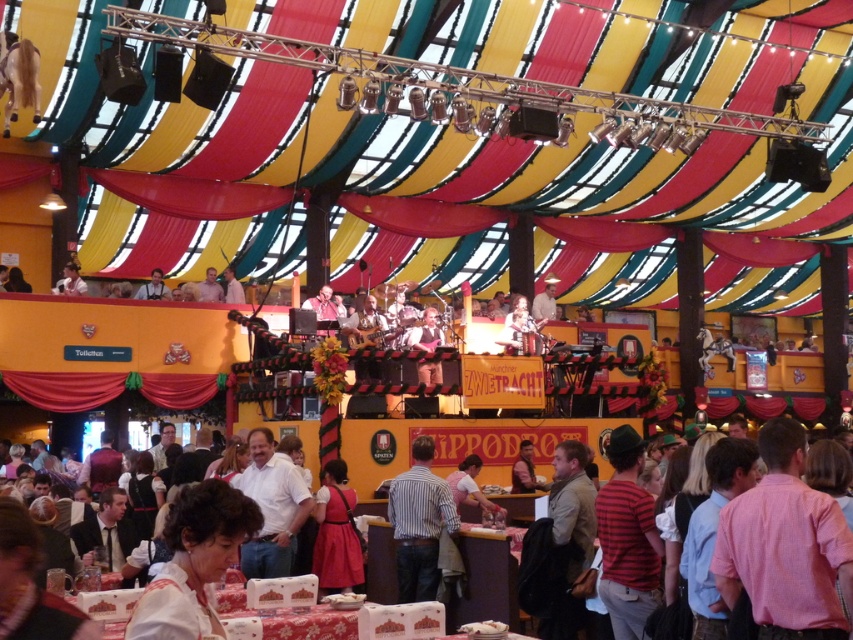
Who is taller, matte black shirt at upper center or light beige shirt at upper center?

light beige shirt at upper center

Is matte black shirt at upper center above light beige shirt at upper center?

No, matte black shirt at upper center is not above light beige shirt at upper center.

Does point (154, 288) come closer to viewer compared to point (201, 298)?

Yes, it is.

At what (x,y) coordinates should I click in order to perform the action: click on matte black shirt at upper center. Please return your answer as a coordinate pair (x, y). The image size is (853, 640). Looking at the image, I should click on (154, 288).

Is white satin blouse at lower center above striped cotton shirt at center?

Yes.

Can you confirm if white satin blouse at lower center is positioned to the right of striped cotton shirt at center?

In fact, white satin blouse at lower center is to the left of striped cotton shirt at center.

Does point (198, 536) come farther from viewer compared to point (440, 502)?

No, (198, 536) is closer to viewer.

Identify the location of white satin blouse at lower center. The height and width of the screenshot is (640, 853). tap(194, 563).

This screenshot has width=853, height=640. What do you see at coordinates (419, 522) in the screenshot?
I see `striped cotton shirt at center` at bounding box center [419, 522].

Which is in front, point (393, 531) or point (233, 285)?

Point (393, 531) is in front.

Does point (416, 541) lie in front of point (228, 296)?

Yes.

The height and width of the screenshot is (640, 853). In order to click on striped cotton shirt at center in this screenshot , I will do tap(419, 522).